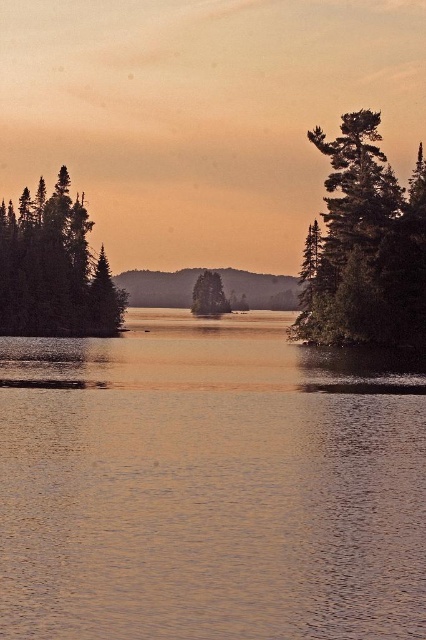
Question: Estimate the real-world distances between objects in this image. Which object is farther from the green matte tree at right?

Choices:
 (A) green matte tree at center
 (B) green matte tree at left
 (C) golden reflective water at center

Answer: (A)

Question: Is the position of golden reflective water at center more distant than that of green matte tree at right?

Choices:
 (A) no
 (B) yes

Answer: (A)

Question: Considering the real-world distances, which object is closest to the green matte tree at right?

Choices:
 (A) green matte tree at center
 (B) golden reflective water at center
 (C) green matte tree at left

Answer: (B)

Question: Does green matte tree at right appear on the left side of green matte tree at left?

Choices:
 (A) yes
 (B) no

Answer: (B)

Question: Considering the real-world distances, which object is closest to the green matte tree at center?

Choices:
 (A) green matte tree at right
 (B) golden reflective water at center
 (C) green matte tree at left

Answer: (C)

Question: Is green matte tree at right wider than green matte tree at left?

Choices:
 (A) yes
 (B) no

Answer: (B)